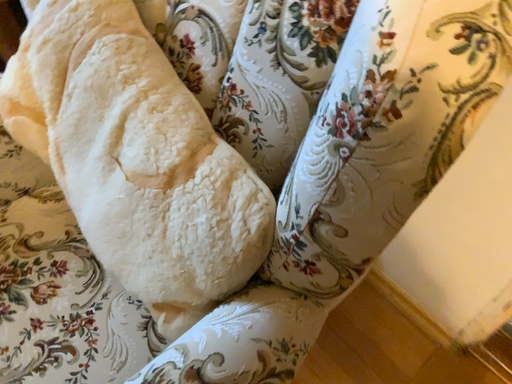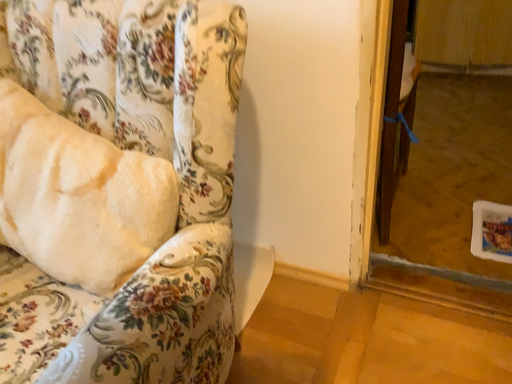
Question: How did the camera likely rotate when shooting the video?

Choices:
 (A) rotated downward
 (B) rotated upward

Answer: (B)